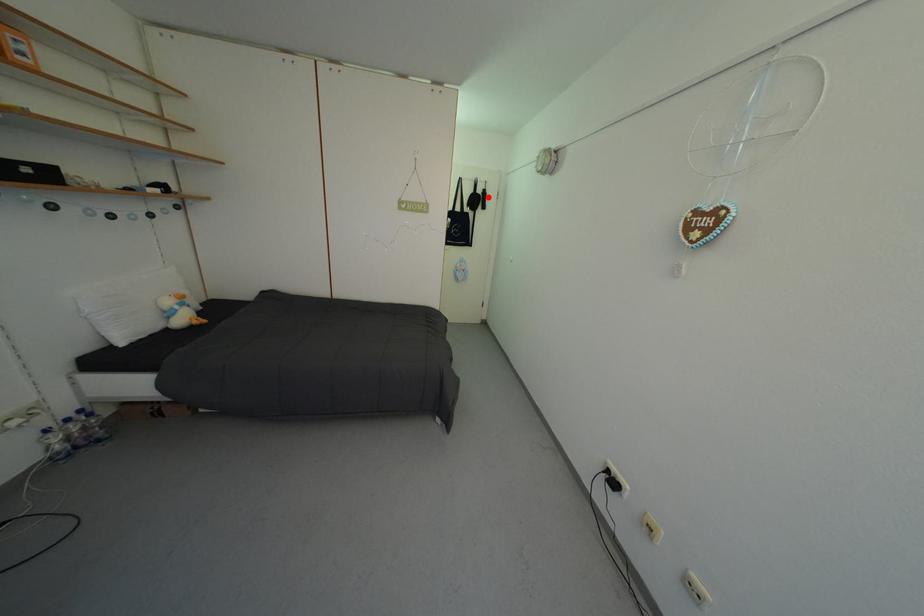
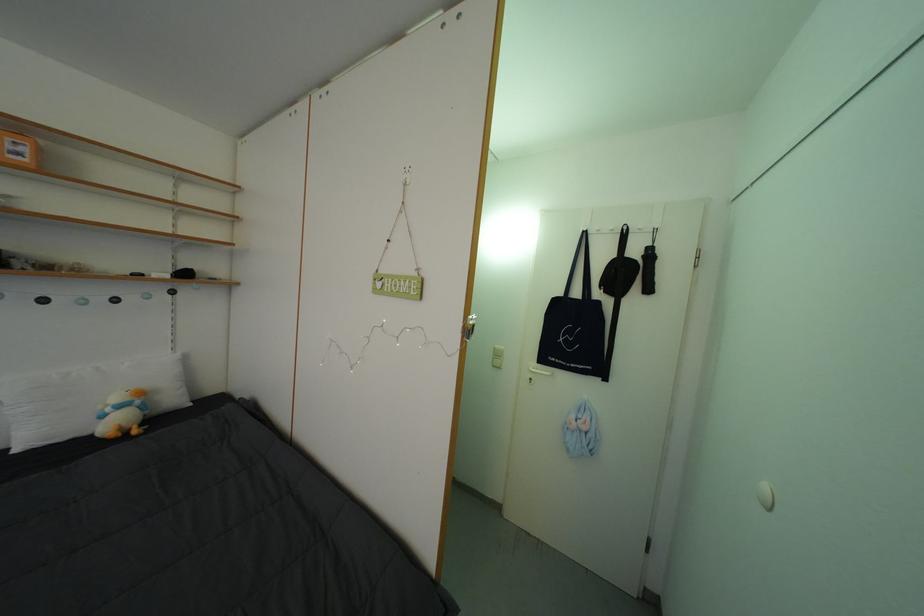
Question: A red point is marked in image1. In image2, is the corresponding 3D point closer to the camera or farther? Reply with the corresponding letter.

Choices:
 (A) The corresponding 3D point is closer.
 (B) The corresponding 3D point is farther.

Answer: (B)